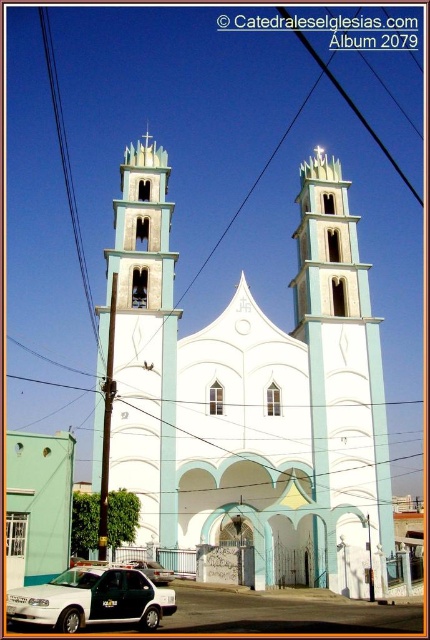
Is point (157, 170) positioned before point (91, 577)?

That is False.

Who is more forward, [172,492] or [89,595]?

Point [89,595] is in front.

The image size is (430, 640). What do you see at coordinates (141, 342) in the screenshot?
I see `light blue concrete tower at center` at bounding box center [141, 342].

At what (x,y) coordinates should I click in order to perform the action: click on light blue concrete tower at center. Please return your answer as a coordinate pair (x, y). This screenshot has height=640, width=430. Looking at the image, I should click on (141, 342).

In the scene shown: Can you confirm if white smooth church at center is positioned below white matte car at lower left?

No.

Is white smooth church at center above white matte car at lower left?

Indeed, white smooth church at center is positioned over white matte car at lower left.

Which is in front, point (255, 502) or point (18, 609)?

Point (18, 609) is more forward.

Image resolution: width=430 pixels, height=640 pixels. Find the location of `white smooth church at center`. white smooth church at center is located at coordinates (251, 392).

Is point (162, 508) positioned after point (51, 92)?

That is False.

Can you confirm if light blue concrete tower at center is thinner than black wire at left?

Yes.

Where is `light blue concrete tower at center`? The height and width of the screenshot is (640, 430). light blue concrete tower at center is located at coordinates (141, 342).